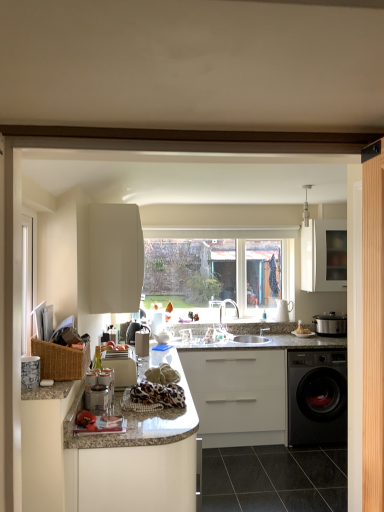
Image resolution: width=384 pixels, height=512 pixels. What do you see at coordinates (268, 391) in the screenshot?
I see `granite countertop at center` at bounding box center [268, 391].

Where is `white glossy cabinet at upper center, positioned as the 4th cabinetry in left-to-right order`? This screenshot has width=384, height=512. white glossy cabinet at upper center, positioned as the 4th cabinetry in left-to-right order is located at coordinates (324, 255).

In order to face matte silver slow cooker at right, acting as the first appliance starting from the right, should I rotate leftwards or rightwards?

You should look right and rotate roughly 18.561 degrees.

What is the approximate height of matte silver slow cooker at right, acting as the 1th appliance starting from the back?

The height of matte silver slow cooker at right, acting as the 1th appliance starting from the back, is 10.26 inches.

I want to click on black glossy washing machine at lower right, so click(x=317, y=397).

In the image, is matte silver slow cooker at right, arranged as the second appliance when viewed from the front, on the left side or the right side of white matte cabinet at center, which is counted as the 3th cabinetry, starting from the left?

Clearly, matte silver slow cooker at right, arranged as the second appliance when viewed from the front, is on the right of white matte cabinet at center, which is counted as the 3th cabinetry, starting from the left, in the image.

Which of these two, matte silver slow cooker at right, acting as the 1th appliance starting from the back, or white matte cabinet at center, which ranks as the 2th cabinetry in right-to-left order, stands taller?

white matte cabinet at center, which ranks as the 2th cabinetry in right-to-left order, is taller.

Which is nearer, [329,323] or [242,412]?

The point [329,323] is closer.

This screenshot has width=384, height=512. Find the location of `the 2nd cabinetry to the left of the matte silver slow cooker at right, the 2th appliance positioned from the left, starting your count from the anchor`. the 2nd cabinetry to the left of the matte silver slow cooker at right, the 2th appliance positioned from the left, starting your count from the anchor is located at coordinates (238, 396).

Could you tell me if matte white toaster at center, arranged as the second appliance when viewed from the right, is facing black glossy washing machine at lower right?

No.

Which object is positioned more to the right, matte white toaster at center, which is the second appliance from back to front, or black glossy washing machine at lower right?

Positioned to the right is black glossy washing machine at lower right.

Considering the positions of points (117, 387) and (326, 430), is point (117, 387) farther from camera compared to point (326, 430)?

No, it is not.

Considering the points (37, 490) and (260, 481), which point is in front, point (37, 490) or point (260, 481)?

The point (37, 490) is in front.

Between white glossy countertop at center, the second cabinetry viewed from the left, and black glossy tile at lower center, which one has more height?

With more height is white glossy countertop at center, the second cabinetry viewed from the left.

Does white glossy countertop at center, the second cabinetry viewed from the left, turn towards black glossy tile at lower center?

Yes, white glossy countertop at center, the second cabinetry viewed from the left, is turned towards black glossy tile at lower center.

Which of these two, white glossy countertop at center, which is the 3th cabinetry from right to left, or black glossy tile at lower center, is smaller?

With smaller size is black glossy tile at lower center.

From a real-world perspective, which object rests below the other?

satin nickel faucet at center is physically lower.

Is satin nickel faucet at center positioned with its back to woven brown basket at left?

No, woven brown basket at left is not at the back of satin nickel faucet at center.

From the image's perspective, which is above, matte silver slow cooker at right, arranged as the second appliance when viewed from the front, or black glossy washing machine at lower right?

matte silver slow cooker at right, arranged as the second appliance when viewed from the front.

From a real-world perspective, who is located lower, matte silver slow cooker at right, the 2th appliance positioned from the left, or black glossy washing machine at lower right?

black glossy washing machine at lower right, from a real-world perspective.

Considering the relative sizes of matte silver slow cooker at right, acting as the 1th appliance starting from the back, and black glossy washing machine at lower right in the image provided, is matte silver slow cooker at right, acting as the 1th appliance starting from the back, smaller than black glossy washing machine at lower right?

Correct, matte silver slow cooker at right, acting as the 1th appliance starting from the back, occupies less space than black glossy washing machine at lower right.

Can you confirm if woven brown basket at left is taller than white glossy cabinet at upper center, positioned as the 4th cabinetry in left-to-right order?

No, woven brown basket at left is not taller than white glossy cabinet at upper center, positioned as the 4th cabinetry in left-to-right order.

Between woven brown basket at left and white glossy cabinet at upper center, which is counted as the first cabinetry, starting from the right, which one has smaller size?

woven brown basket at left is smaller.

Relative to white glossy cabinet at upper center, which is counted as the first cabinetry, starting from the right, is woven brown basket at left in front or behind?

woven brown basket at left is positioned closer to the viewer than white glossy cabinet at upper center, which is counted as the first cabinetry, starting from the right.

Considering the positions of points (74, 350) and (326, 233), is point (74, 350) farther from camera compared to point (326, 233)?

No, (74, 350) is closer to viewer.

Considering the points (317, 291) and (156, 473), which point is behind, point (317, 291) or point (156, 473)?

The point (317, 291) is more distant.

Is white glossy cabinet at upper center, positioned as the 4th cabinetry in left-to-right order, facing towards white glossy countertop at center, the second cabinetry viewed from the left?

No.

Which object is further away from the camera taking this photo, white glossy cabinet at upper center, which is counted as the first cabinetry, starting from the right, or white glossy countertop at center, which is the 3th cabinetry from right to left?

white glossy cabinet at upper center, which is counted as the first cabinetry, starting from the right, is behind.

From a real-world perspective, who is located higher, white glossy cabinet at upper center, positioned as the 4th cabinetry in left-to-right order, or white glossy countertop at center, the second cabinetry viewed from the left?

white glossy cabinet at upper center, positioned as the 4th cabinetry in left-to-right order, from a real-world perspective.

You are a GUI agent. You are given a task and a screenshot of the screen. Output one action in this format:
    pyautogui.click(x=<x>, y=<y>)
    Task: Click on the appliance that is the 2nd one above the white matte cabinet at center, which is counted as the 3th cabinetry, starting from the left (from a real-world perspective)
    This screenshot has height=512, width=384.
    Given the screenshot: What is the action you would take?
    pyautogui.click(x=330, y=324)

I want to click on washing machine directly beneath the matte white toaster at center, arranged as the second appliance when viewed from the right (from a real-world perspective), so click(x=317, y=397).

Which object lies nearer to the anchor point white matte cabinet at upper center, the 4th cabinetry viewed from the right, white glossy cabinet at upper center, which is counted as the first cabinetry, starting from the right, or granite countertop at center?

granite countertop at center is positioned closer to the anchor white matte cabinet at upper center, the 4th cabinetry viewed from the right.

Considering their positions, is light wood barn door at right positioned further to white glossy countertop at center, the second cabinetry viewed from the left, than woven brown basket at left?

light wood barn door at right is positioned further to the anchor white glossy countertop at center, the second cabinetry viewed from the left.

Estimate the real-world distances between objects in this image. Which object is closer to woven brown basket at left, black glossy tile at lower center or matte silver slow cooker at right, acting as the 1th appliance starting from the back?

matte silver slow cooker at right, acting as the 1th appliance starting from the back, is positioned closer to the anchor woven brown basket at left.

Based on their spatial positions, is light wood barn door at right or black glossy tile at lower center further from white glossy countertop at center, the second cabinetry viewed from the left?

Based on the image, light wood barn door at right appears to be further to white glossy countertop at center, the second cabinetry viewed from the left.

Which object lies nearer to the anchor point black glossy tile at lower center, white matte cabinet at upper center, which is counted as the 1th cabinetry, starting from the left, or white glossy cabinet at upper center, which is counted as the first cabinetry, starting from the right?

Based on the image, white matte cabinet at upper center, which is counted as the 1th cabinetry, starting from the left, appears to be nearer to black glossy tile at lower center.

From the image, which object appears to be farther from woven brown basket at left, white glossy cabinet at upper center, which is counted as the first cabinetry, starting from the right, or white matte cabinet at upper center, the 4th cabinetry viewed from the right?

The object further to woven brown basket at left is white glossy cabinet at upper center, which is counted as the first cabinetry, starting from the right.

Looking at the image, which one is located closer to granite countertop at center, matte silver slow cooker at right, acting as the 1th appliance starting from the back, or light wood barn door at right?

Based on the image, matte silver slow cooker at right, acting as the 1th appliance starting from the back, appears to be nearer to granite countertop at center.

When comparing their distances from matte silver slow cooker at right, the 2th appliance positioned from the left, does white glossy countertop at center, which is the 3th cabinetry from right to left, or white matte cabinet at center, which is counted as the 3th cabinetry, starting from the left, seem further?

Result: Based on the image, white glossy countertop at center, which is the 3th cabinetry from right to left, appears to be further to matte silver slow cooker at right, the 2th appliance positioned from the left.

Locate an element on the screen. The width and height of the screenshot is (384, 512). countertop located between light wood barn door at right and black glossy washing machine at lower right in the depth direction is located at coordinates (268, 391).

Where is `appliance positioned between granite countertop at center and black glossy washing machine at lower right from near to far`? The width and height of the screenshot is (384, 512). appliance positioned between granite countertop at center and black glossy washing machine at lower right from near to far is located at coordinates (122, 371).

Find the location of `washing machine located between satin nickel faucet at center and matte silver slow cooker at right, acting as the first appliance starting from the right, in the left-right direction`. washing machine located between satin nickel faucet at center and matte silver slow cooker at right, acting as the first appliance starting from the right, in the left-right direction is located at coordinates (317, 397).

You are a GUI agent. You are given a task and a screenshot of the screen. Output one action in this format:
    pyautogui.click(x=<x>, y=<y>)
    Task: Click on the tap located between matte white toaster at center, arranged as the second appliance when viewed from the right, and white glossy cabinet at upper center, which is counted as the first cabinetry, starting from the right, in the left-right direction
    This screenshot has height=512, width=384.
    Given the screenshot: What is the action you would take?
    pyautogui.click(x=222, y=309)